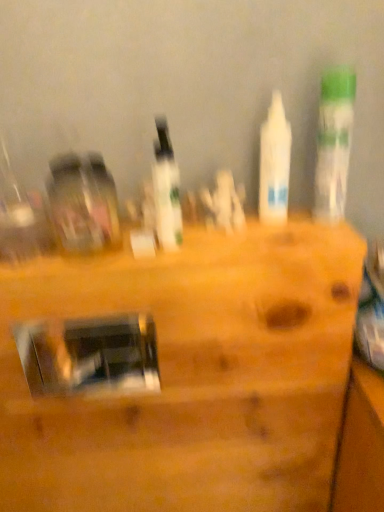
At what (x,y) coordinates should I click in order to perform the action: click on vacant space to the left of white matte bottle at center, which is the 2th bottle from right to left. Please return your answer as a coordinate pair (x, y). The width and height of the screenshot is (384, 512). Looking at the image, I should click on (176, 239).